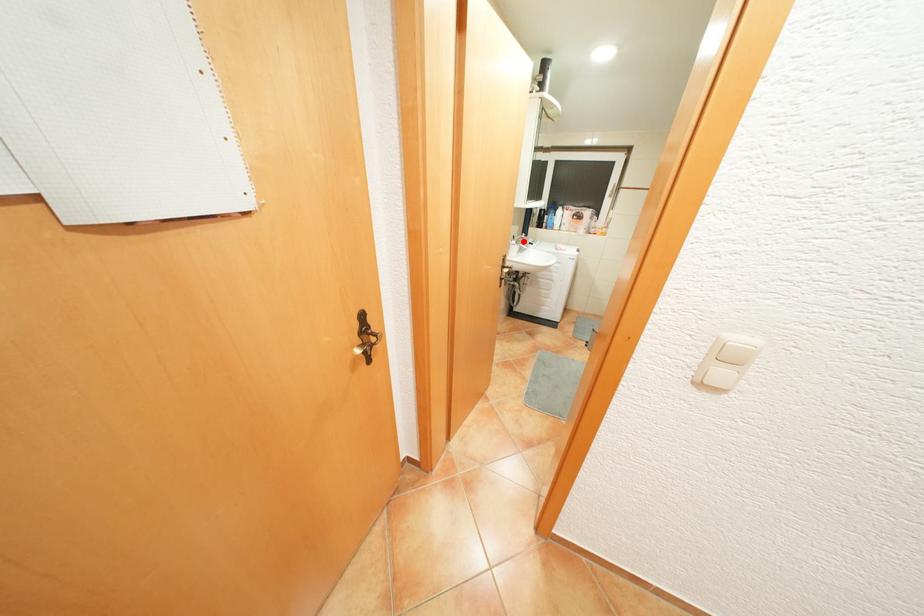
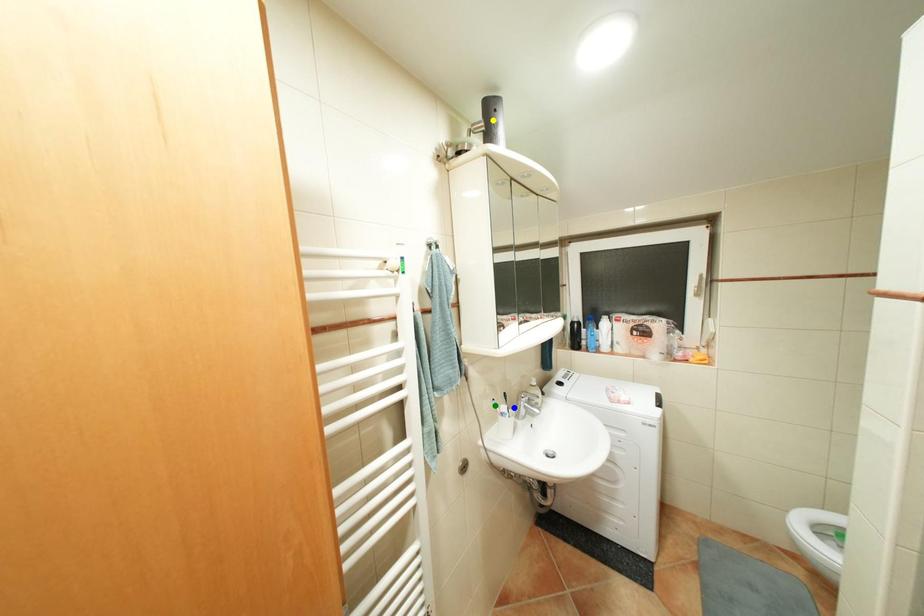
Question: I am providing you with two images of the same scene from different viewpoints. A red point is marked on the first image. You are given multiple points on the second image. Which point in image 2 is actually the same real-world point as the red point in image 1?

Choices:
 (A) yellow point
 (B) blue point
 (C) green point

Answer: (B)